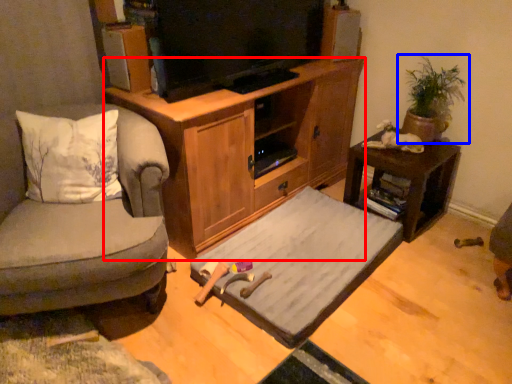
Question: Which point is closer to the camera, cabinetry (highlighted by a red box) or houseplant (highlighted by a blue box)?

Choices:
 (A) cabinetry
 (B) houseplant

Answer: (A)